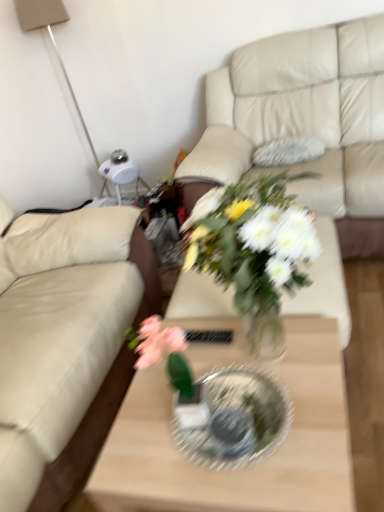
Identify the location of free region on the left part of translucent glass vase at center. This screenshot has height=512, width=384. (160, 393).